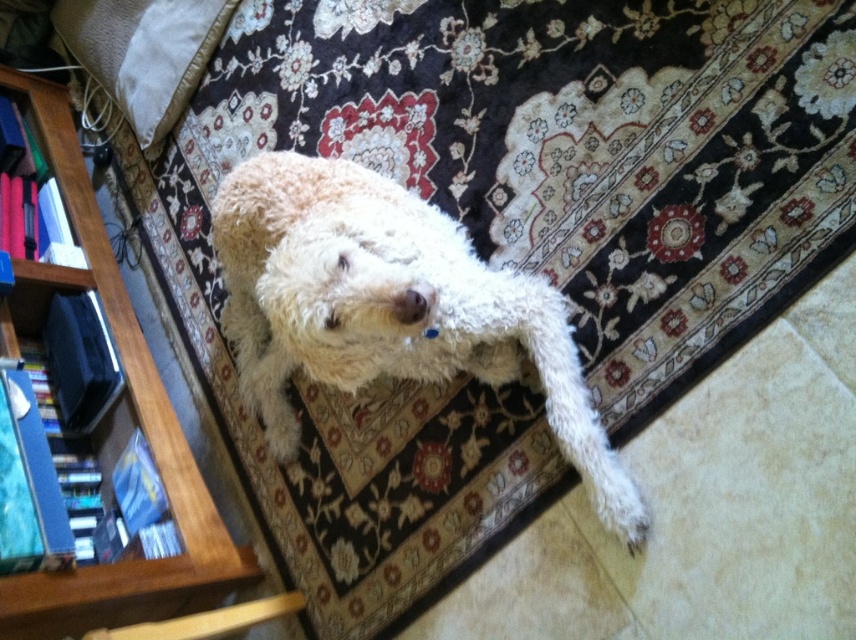
You are a small toy that wants to roll from the wooden bookshelf at left to the soft beige pillow at upper left. Considering their heights, which object will you end up below when you stop rolling?

The wooden bookshelf at left has a greater height compared to the soft beige pillow at upper left, so you will end up below the wooden bookshelf at left when you stop rolling.

You are a photographer standing in front of the white fluffy dog at center and the soft beige pillow at upper left. You want to take a photo that focuses on the dog while keeping the pillow in the background. Which object should be placed closer to the camera to achieve this effect?

To focus on the white fluffy dog at center while keeping the soft beige pillow at upper left in the background, the white fluffy dog at center should be placed closer to the camera since it is already closer to the viewer than the pillow.